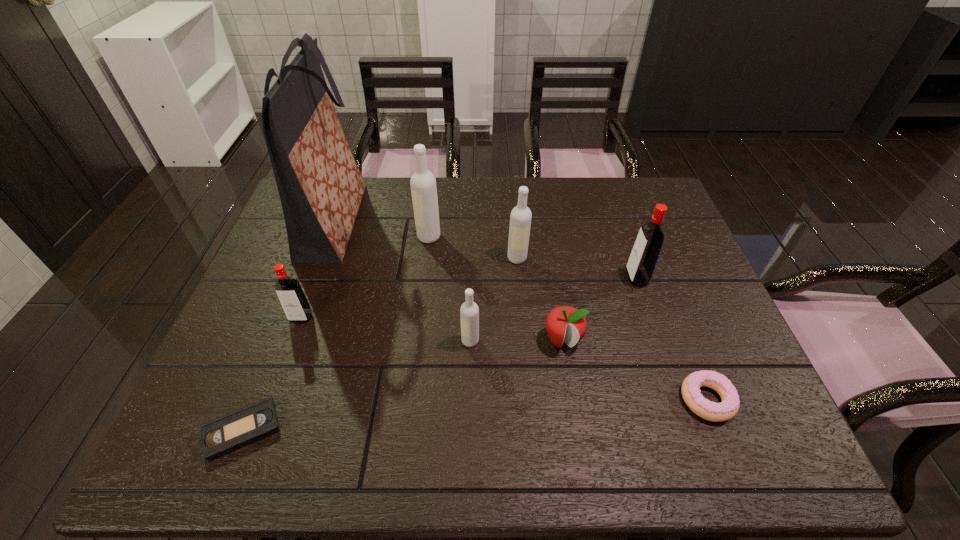
Where is `vacant area that satisfies the following two spatial constraints: 1. on the front-facing side of the second shortest object; 2. on the right side of the tallest object`? vacant area that satisfies the following two spatial constraints: 1. on the front-facing side of the second shortest object; 2. on the right side of the tallest object is located at coordinates (271, 400).